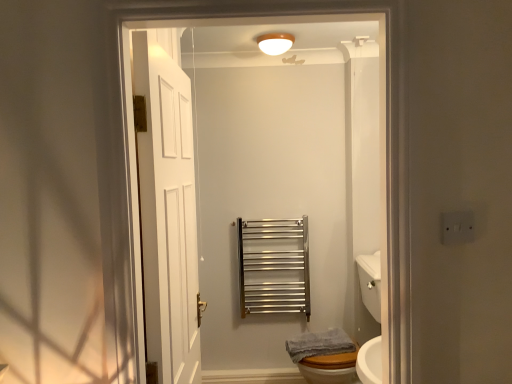
You are a GUI agent. You are given a task and a screenshot of the screen. Output one action in this format:
    pyautogui.click(x=<x>, y=<y>)
    Task: Click on the gray cotton towel at lower right
    This screenshot has width=512, height=384.
    Given the screenshot: What is the action you would take?
    pyautogui.click(x=319, y=344)

The image size is (512, 384). What are the coordinates of `white wooden door at center, which appears as the second door when viewed from the back` in the screenshot? It's located at (378, 138).

Identify the location of white wooden door at left, the 1th door from the back. (167, 207).

Locate an element on the screen. The height and width of the screenshot is (384, 512). door that is the 2nd one when counting leftward from the white glossy sink at lower right is located at coordinates (167, 207).

Looking at this image, does white wooden door at left, the 1th door viewed from the left, appear on the right side of white glossy sink at lower right?

No.

Would you say white wooden door at left, which ranks as the 2th door in front-to-back order, is inside or outside white glossy sink at lower right?

white wooden door at left, which ranks as the 2th door in front-to-back order, is located beyond the bounds of white glossy sink at lower right.

Based on the photo, considering the relative sizes of satin nickel towel rail at center and white wooden door at left, which ranks as the 2th door in front-to-back order, in the image provided, is satin nickel towel rail at center smaller than white wooden door at left, which ranks as the 2th door in front-to-back order,?

No, satin nickel towel rail at center is not smaller than white wooden door at left, which ranks as the 2th door in front-to-back order.

You are a GUI agent. You are given a task and a screenshot of the screen. Output one action in this format:
    pyautogui.click(x=<x>, y=<y>)
    Task: Click on the balustrade below the white wooden door at left, the 1th door viewed from the left (from the image's perspective)
    The image size is (512, 384).
    Given the screenshot: What is the action you would take?
    274,266

Is satin nickel towel rail at center completely or partially outside of white wooden door at left, which ranks as the 2th door in front-to-back order?

Yes, satin nickel towel rail at center is located beyond the bounds of white wooden door at left, which ranks as the 2th door in front-to-back order.

Which of these two, satin nickel towel rail at center or white wooden door at left, the 1th door viewed from the left, is thinner?

white wooden door at left, the 1th door viewed from the left.

Is white glossy light fixture at upper center oriented away from gray cotton towel at lower right?

No, white glossy light fixture at upper center is not facing the opposite direction of gray cotton towel at lower right.

Is white glossy light fixture at upper center touching gray cotton towel at lower right?

No.

From a real-world perspective, which object rests below the other?

gray cotton towel at lower right, from a real-world perspective.

Between gray cotton towel at lower right and white glossy light fixture at upper center, which one has less height?

With less height is white glossy light fixture at upper center.

From a real-world perspective, is gray cotton towel at lower right beneath white glossy light fixture at upper center?

Yes, from a real-world perspective, gray cotton towel at lower right is beneath white glossy light fixture at upper center.

What are the coordinates of `bath towel that appears behind the white glossy light fixture at upper center` in the screenshot? It's located at (319, 344).

Considering the relative sizes of gray cotton towel at lower right and white glossy light fixture at upper center in the image provided, is gray cotton towel at lower right wider than white glossy light fixture at upper center?

Yes, gray cotton towel at lower right is wider than white glossy light fixture at upper center.

Is gray cotton towel at lower right positioned with its back to white wooden door at left, the 1th door viewed from the left?

gray cotton towel at lower right is not turned away from white wooden door at left, the 1th door viewed from the left.

From a real-world perspective, is gray cotton towel at lower right physically located above or below white wooden door at left, the 1th door from the back?

gray cotton towel at lower right is situated lower than white wooden door at left, the 1th door from the back, in the real world.

Considering the positions of objects gray cotton towel at lower right and white wooden door at left, which ranks as the 2th door in front-to-back order, in the image provided, who is more to the right, gray cotton towel at lower right or white wooden door at left, which ranks as the 2th door in front-to-back order,?

gray cotton towel at lower right is more to the right.

Can we say gray cotton towel at lower right lies outside white wooden door at left, which ranks as the 2th door in front-to-back order?

Yes, gray cotton towel at lower right is outside of white wooden door at left, which ranks as the 2th door in front-to-back order.

From a real-world perspective, is gray cotton towel at lower right positioned under white glossy sink at lower right based on gravity?

Yes.

I want to click on sink that is in front of the gray cotton towel at lower right, so click(330, 368).

Looking at this image, are gray cotton towel at lower right and white glossy sink at lower right making contact?

There is a gap between gray cotton towel at lower right and white glossy sink at lower right.

Which object is closer to the camera, gray cotton towel at lower right or white glossy sink at lower right?

Positioned in front is white glossy sink at lower right.

Is white wooden door at center, which is the first door in right-to-left order, touching satin nickel towel rail at center?

No, white wooden door at center, which is the first door in right-to-left order, is not making contact with satin nickel towel rail at center.

Is white wooden door at center, the second door when ordered from left to right, taller than satin nickel towel rail at center?

Correct, white wooden door at center, the second door when ordered from left to right, is much taller as satin nickel towel rail at center.

Is white wooden door at center, which is the first door in right-to-left order, outside of satin nickel towel rail at center?

Absolutely, white wooden door at center, which is the first door in right-to-left order, is external to satin nickel towel rail at center.

Which is behind, point (142, 368) or point (262, 271)?

The point (262, 271) is more distant.

Find the location of `sink below the white wooden door at left, the 1th door from the back (from a real-world perspective)`. sink below the white wooden door at left, the 1th door from the back (from a real-world perspective) is located at coordinates click(330, 368).

Locate an element on the screen. This screenshot has width=512, height=384. balustrade that appears on the right of white wooden door at left, which ranks as the 2th door in front-to-back order is located at coordinates (274, 266).

When comparing their distances from white wooden door at center, which is the first door in right-to-left order, does white glossy sink at lower right or white glossy light fixture at upper center seem further?

white glossy light fixture at upper center lies further to white wooden door at center, which is the first door in right-to-left order, than the other object.

Looking at the image, which one is located further to white glossy sink at lower right, white wooden door at center, the first door in the front-to-back sequence, or satin nickel towel rail at center?

white wooden door at center, the first door in the front-to-back sequence, is positioned further to the anchor white glossy sink at lower right.

Looking at the image, which one is located further to white glossy light fixture at upper center, white glossy sink at lower right or gray cotton towel at lower right?

gray cotton towel at lower right is positioned further to the anchor white glossy light fixture at upper center.

Which object lies nearer to the anchor point gray cotton towel at lower right, white wooden door at left, the 1th door from the back, or white glossy sink at lower right?

white glossy sink at lower right lies closer to gray cotton towel at lower right than the other object.

From the image, which object appears to be farther from white glossy sink at lower right, white wooden door at center, the second door when ordered from left to right, or gray cotton towel at lower right?

Among the two, white wooden door at center, the second door when ordered from left to right, is located further to white glossy sink at lower right.

Considering their positions, is white wooden door at center, which appears as the second door when viewed from the back, positioned further to white wooden door at left, the second door in the right-to-left sequence, than gray cotton towel at lower right?

gray cotton towel at lower right.

From the image, which object appears to be nearer to white glossy light fixture at upper center, white wooden door at center, which appears as the second door when viewed from the back, or white glossy sink at lower right?

Among the two, white glossy sink at lower right is located nearer to white glossy light fixture at upper center.

In the scene shown: From the image, which object appears to be nearer to white glossy light fixture at upper center, gray cotton towel at lower right or white wooden door at left, the second door in the right-to-left sequence?

white wooden door at left, the second door in the right-to-left sequence, is positioned closer to the anchor white glossy light fixture at upper center.

Locate an element on the screen. door located between white wooden door at center, the second door when ordered from left to right, and satin nickel towel rail at center in the depth direction is located at coordinates (167, 207).

Find the location of a particular element. The width and height of the screenshot is (512, 384). light fixture between white wooden door at center, which appears as the second door when viewed from the back, and satin nickel towel rail at center in the front-back direction is located at coordinates (275, 43).

You are a GUI agent. You are given a task and a screenshot of the screen. Output one action in this format:
    pyautogui.click(x=<x>, y=<y>)
    Task: Click on the sink between white wooden door at center, which appears as the second door when viewed from the back, and satin nickel towel rail at center in the front-back direction
    The image size is (512, 384).
    Given the screenshot: What is the action you would take?
    pyautogui.click(x=330, y=368)

You are a GUI agent. You are given a task and a screenshot of the screen. Output one action in this format:
    pyautogui.click(x=<x>, y=<y>)
    Task: Click on the door between white wooden door at center, which appears as the second door when viewed from the back, and white glossy sink at lower right, along the z-axis
    The image size is (512, 384).
    Given the screenshot: What is the action you would take?
    pyautogui.click(x=167, y=207)